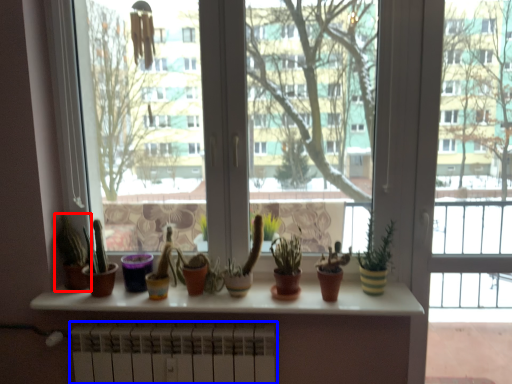
Question: Which object appears farthest to the camera in this image, houseplant (highlighted by a red box) or radiator (highlighted by a blue box)?

Choices:
 (A) houseplant
 (B) radiator

Answer: (A)